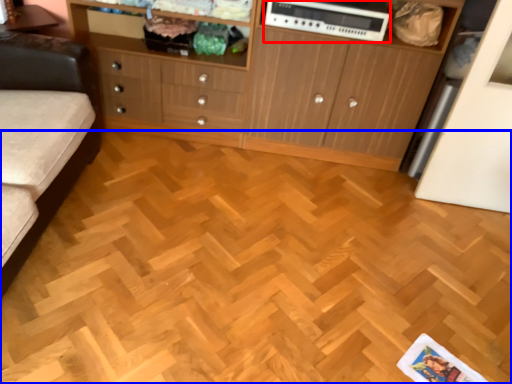
Question: Which object is closer to the camera taking this photo, appliance (highlighted by a red box) or plywood (highlighted by a blue box)?

Choices:
 (A) appliance
 (B) plywood

Answer: (B)